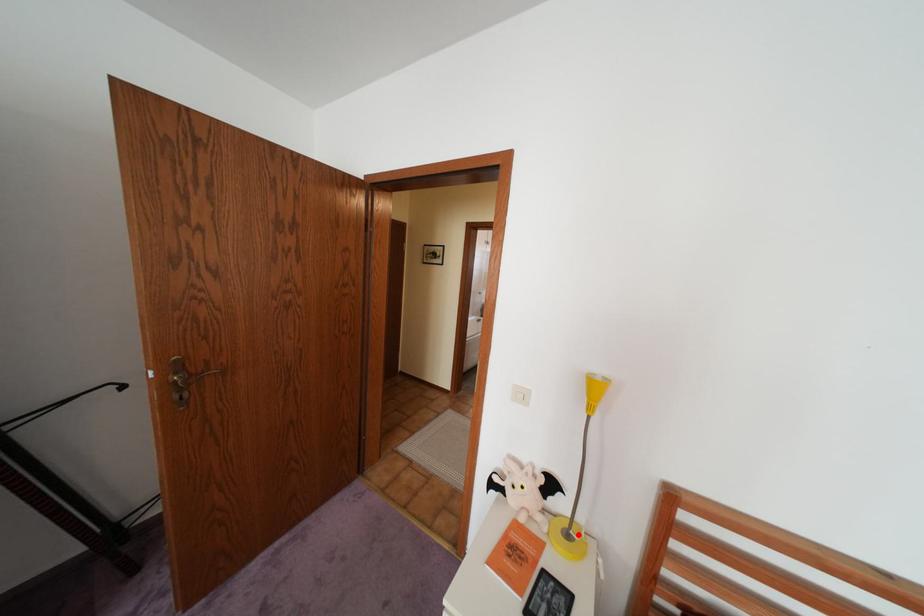
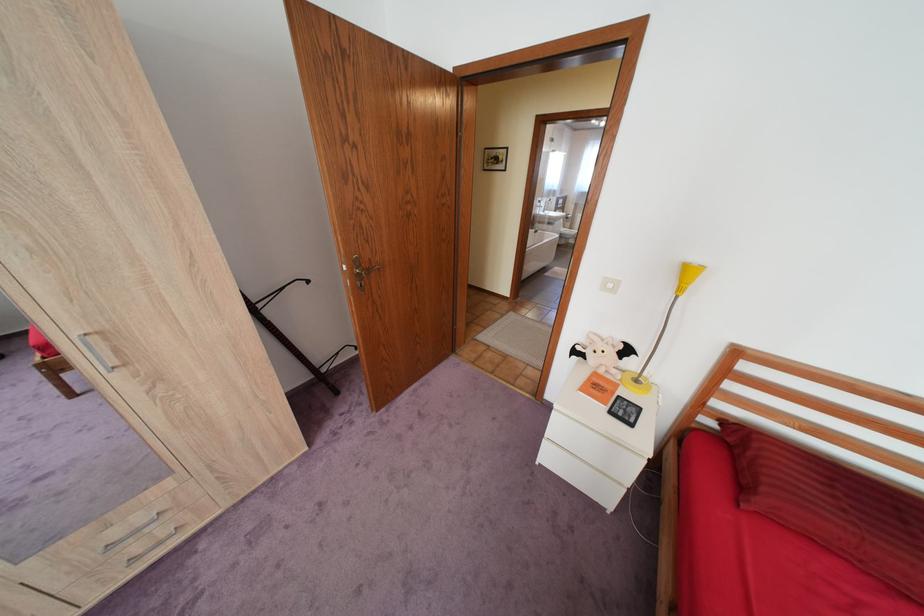
The point at the highlighted location is marked in the first image. Where is the corresponding point in the second image?

(648, 379)